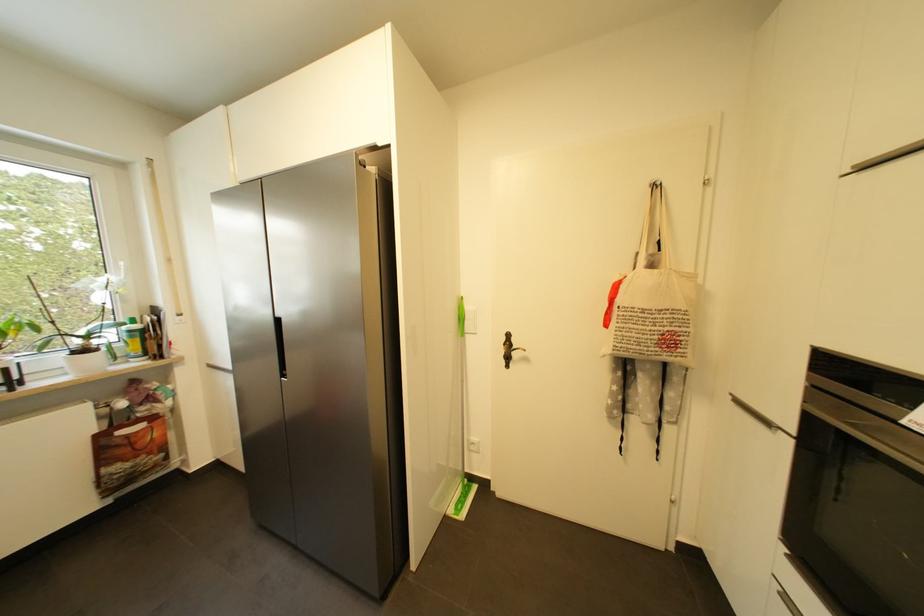
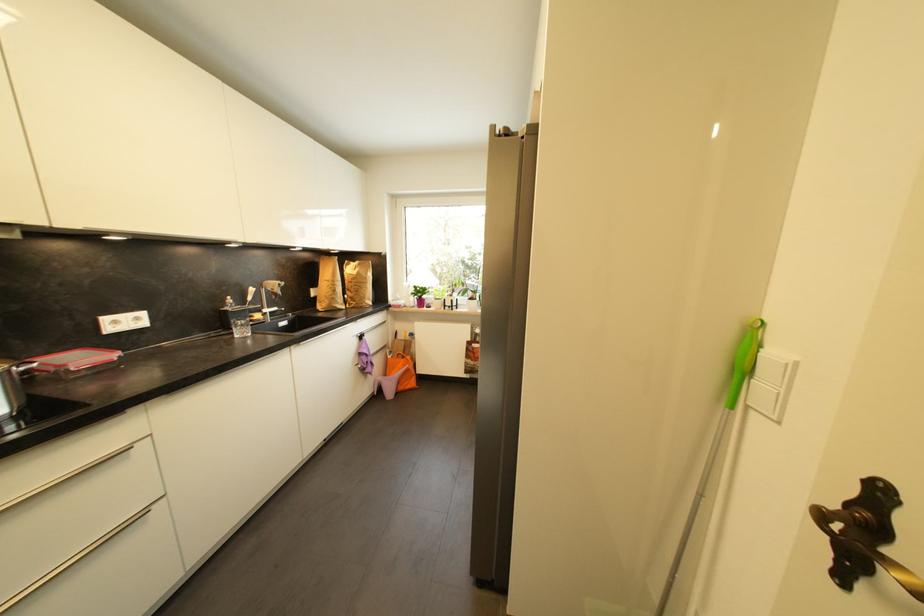
In the second image, find the point that corresponds to (x=466, y=321) in the first image.

(746, 371)